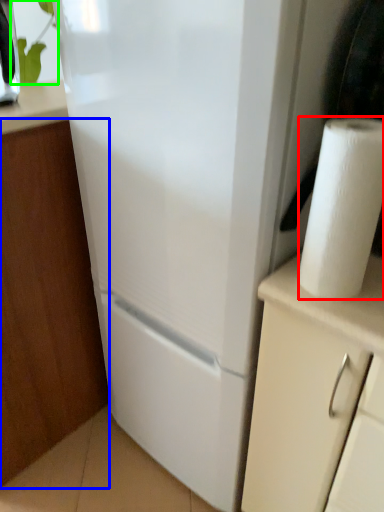
Question: Which object is positioned farthest from paper towel (highlighted by a red box)? Select from cabinetry (highlighted by a blue box) and plant (highlighted by a green box).

Choices:
 (A) cabinetry
 (B) plant

Answer: (B)